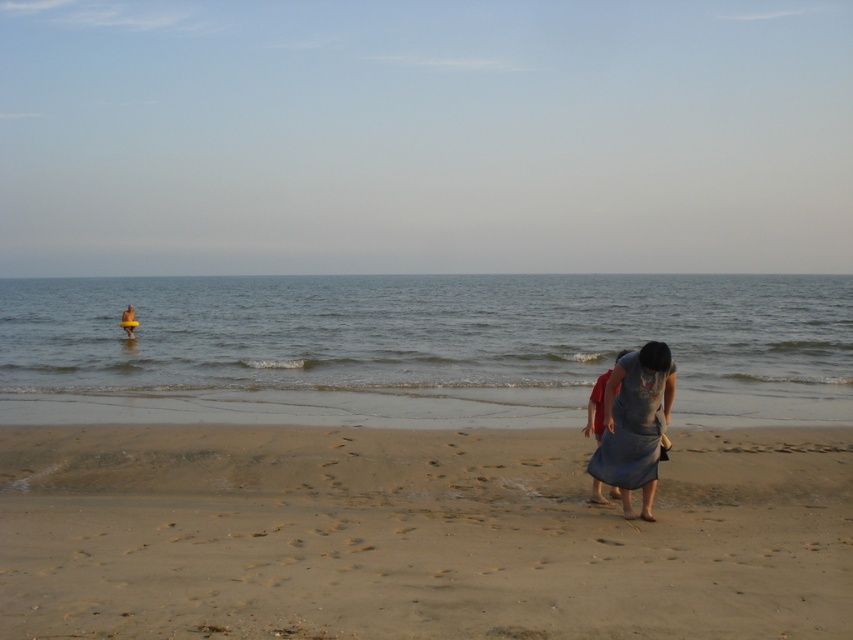
Question: Which object appears farthest from the camera in this image?

Choices:
 (A) yellow rubber ring at center
 (B) sandy beach at lower center
 (C) denim dress at lower right
 (D) denim skirt at lower right

Answer: (A)

Question: Which is farther from the denim skirt at lower right?

Choices:
 (A) yellow rubber ring at center
 (B) denim dress at lower right

Answer: (A)

Question: Does sandy beach at lower center have a smaller size compared to clear blue water at center?

Choices:
 (A) yes
 (B) no

Answer: (A)

Question: Estimate the real-world distances between objects in this image. Which object is farther from the sandy beach at lower center?

Choices:
 (A) yellow rubber ring at center
 (B) denim skirt at lower right
 (C) denim dress at lower right
 (D) clear blue water at center

Answer: (D)

Question: Is sandy beach at lower center positioned at the back of denim skirt at lower right?

Choices:
 (A) no
 (B) yes

Answer: (A)

Question: Does denim skirt at lower right appear under yellow rubber ring at center?

Choices:
 (A) no
 (B) yes

Answer: (B)